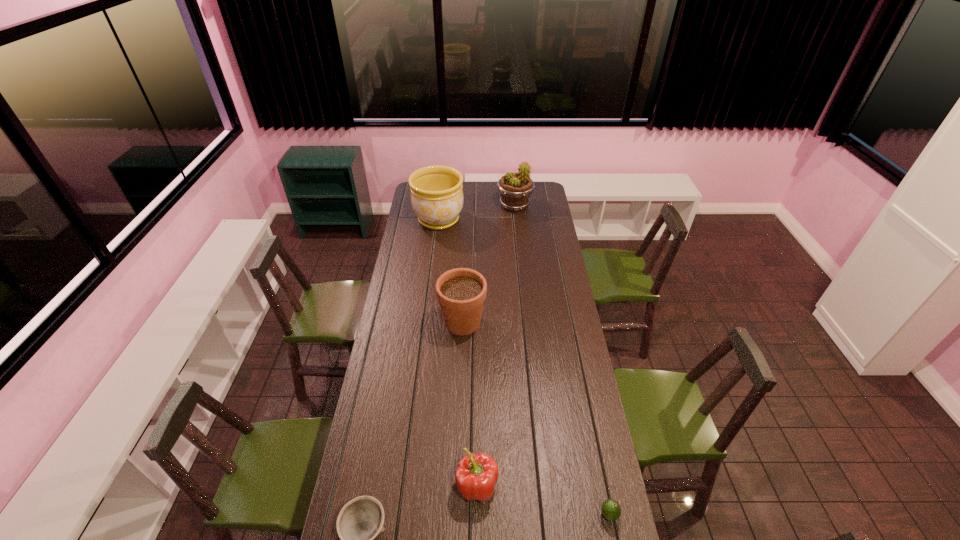
I want to click on the rightmost flowerpot, so click(x=515, y=188).

The image size is (960, 540). Find the location of `the third tallest object`. the third tallest object is located at coordinates (461, 292).

Where is `the nearest flowerpot`? The image size is (960, 540). the nearest flowerpot is located at coordinates (461, 292).

At what (x,y) coordinates should I click in order to perform the action: click on the third shortest object. Please return your answer as a coordinate pair (x, y). This screenshot has height=540, width=960. Looking at the image, I should click on (477, 474).

Locate an element on the screen. avocado is located at coordinates [x=610, y=508].

Identify the location of the rightmost object. (610, 508).

Image resolution: width=960 pixels, height=540 pixels. In order to click on vacant area situated on the front of the rightmost flowerpot in this screenshot , I will do `click(517, 231)`.

Find the location of a particular element. The image size is (960, 540). blank space located on the front of the nearest flowerpot is located at coordinates (460, 399).

Where is `vacant space located on the left of the pepper`? The width and height of the screenshot is (960, 540). vacant space located on the left of the pepper is located at coordinates (348, 485).

This screenshot has height=540, width=960. Find the location of `free space located on the left of the second shortest object`. free space located on the left of the second shortest object is located at coordinates (544, 515).